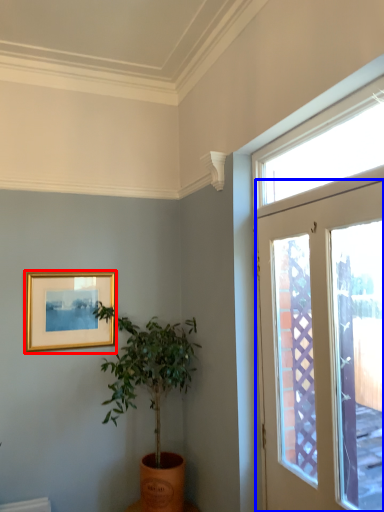
Question: Which object is closer to the camera taking this photo, picture frame (highlighted by a red box) or door (highlighted by a blue box)?

Choices:
 (A) picture frame
 (B) door

Answer: (B)